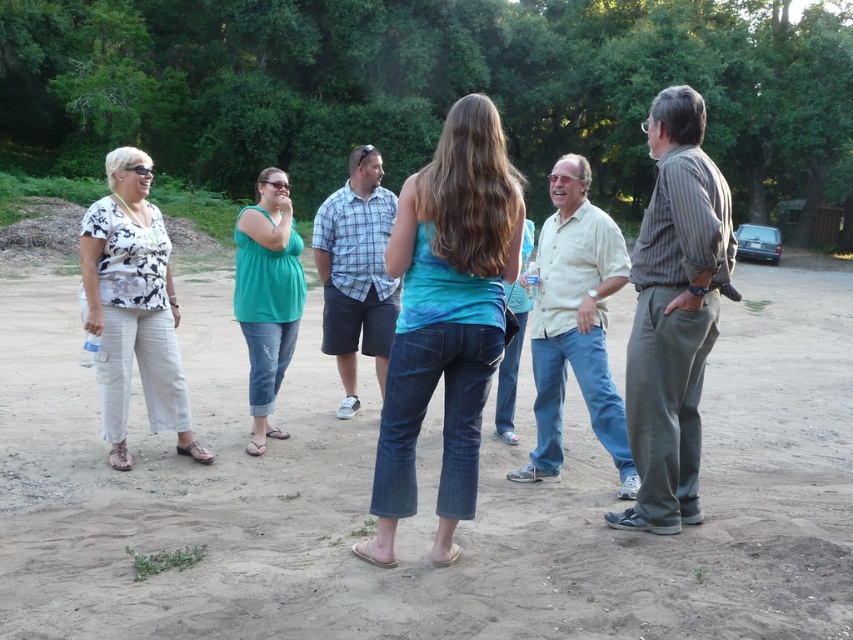
Question: Which point is farther to the camera?

Choices:
 (A) brown dirt track at center
 (B) light blue plaid shirt at center
 (C) white linen pants at left

Answer: (B)

Question: In this image, where is white linen pants at left located relative to white cotton shirt at center?

Choices:
 (A) above
 (B) below

Answer: (B)

Question: Does blue denim jeans at center appear on the left side of teal matte tank top at center?

Choices:
 (A) yes
 (B) no

Answer: (B)

Question: Among these points, which one is farthest from the camera?

Choices:
 (A) (700, 436)
 (B) (129, 209)
 (C) (469, 525)
 (D) (326, 211)

Answer: (D)

Question: Does blue denim jeans at center come behind white cotton shirt at center?

Choices:
 (A) yes
 (B) no

Answer: (B)

Question: Which of the following is the closest to the observer?

Choices:
 (A) (344, 228)
 (B) (701, 108)
 (C) (242, 275)

Answer: (B)